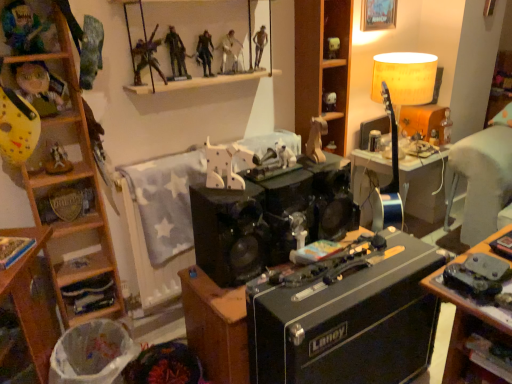
Measure the distance between metallic figure at upper center, which is the 3th person from left to right, and camera.

The depth of metallic figure at upper center, which is the 3th person from left to right, is 1.57 meters.

Describe the element at coordinates (205, 53) in the screenshot. I see `metallic figure at upper center, which is the 3th person in right-to-left order` at that location.

Find the location of a particular element. The image size is (512, 384). smooth white figure at upper center, which is the 2th person from right to left is located at coordinates (230, 53).

The width and height of the screenshot is (512, 384). Describe the element at coordinates (322, 66) in the screenshot. I see `wooden shelf at center, the 3th shelf from the left` at that location.

Locate an element on the screen. The image size is (512, 384). wooden shelf at center, the 2th shelf ordered from the bottom is located at coordinates (322, 66).

Measure the distance between point (x=103, y=325) and camera.

1.52 meters.

You are a GUI agent. You are given a task and a screenshot of the screen. Output one action in this format:
    pyautogui.click(x=<x>, y=<y>)
    Task: Click on the metallic silver figure at upper center, the 7th person positioned from the left
    The height and width of the screenshot is (384, 512).
    Given the screenshot: What is the action you would take?
    point(260,45)

This screenshot has height=384, width=512. Find the location of `metallic figure at upper center, which is the fourth person from left to right`. metallic figure at upper center, which is the fourth person from left to right is located at coordinates 176,54.

Which is less distant, (233, 54) or (326, 96)?

Positioned in front is point (233, 54).

Which is behind, smooth white figure at upper center, which is the 2th person from right to left, or matte white skull at upper center, which appears as the second toy when viewed from the top?

matte white skull at upper center, which appears as the second toy when viewed from the top.

From a real-world perspective, is smooth white figure at upper center, which is the 2th person from right to left, physically located above or below matte white skull at upper center, which is the 1th toy from right to left?

Clearly, from a real-world perspective, smooth white figure at upper center, which is the 2th person from right to left, is above matte white skull at upper center, which is the 1th toy from right to left.

Are smooth white figure at upper center, which is the 6th person in left-to-right order, and matte white skull at upper center, the 1th toy when ordered from back to front, beside each other?

No, smooth white figure at upper center, which is the 6th person in left-to-right order, is not next to matte white skull at upper center, the 1th toy when ordered from back to front.

Does metallic silver figurine at left, the first toy when ordered from left to right, have a lesser width compared to wooden cabinet at left?

Yes, metallic silver figurine at left, the first toy when ordered from left to right, is thinner than wooden cabinet at left.

From a real-world perspective, which is physically below, metallic silver figurine at left, which is the 2th toy in bottom-to-top order, or wooden cabinet at left?

From a 3D spatial view, wooden cabinet at left is below.

Measure the distance between metallic silver figurine at left, the first toy when ordered from left to right, and wooden cabinet at left.

They are 10.09 inches apart.

Is point (56, 154) closer or farther from the camera than point (53, 281)?

Point (56, 154) appears to be closer to the viewer than point (53, 281).

Looking at their sizes, would you say wooden shelves at lower left, positioned as the third shelf in right-to-left order, is wider or thinner than metallic figure at upper center, the 5th person when ordered from right to left?

Considering their sizes, wooden shelves at lower left, positioned as the third shelf in right-to-left order, looks broader than metallic figure at upper center, the 5th person when ordered from right to left.

Is wooden shelves at lower left, which appears as the 1th shelf when ordered from the bottom, positioned behind metallic figure at upper center, which is the 3th person from left to right?

Yes, it is.

From a real-world perspective, starting from the wooden shelves at lower left, which appears as the 1th shelf when ordered from the bottom, which person is the 2nd one vertically above it? Please provide its 2D coordinates.

[(147, 57)]

Is metallic figure at upper center, which is the 3th person from left to right, closer to the viewer compared to matte yellow mask at left, positioned as the first person in left-to-right order?

No.

Does point (158, 64) lie in front of point (32, 68)?

No.

Can you confirm if metallic figure at upper center, which is the 3th person from left to right, is smaller than matte yellow mask at left, positioned as the first person in left-to-right order?

Indeed, metallic figure at upper center, which is the 3th person from left to right, has a smaller size compared to matte yellow mask at left, positioned as the first person in left-to-right order.

Looking at this image, from the image's perspective, between metallic figure at upper center, which is the 3th person from left to right, and matte yellow mask at left, positioned as the first person in left-to-right order, which one is located above?

metallic figure at upper center, which is the 3th person from left to right, appears higher in the image.

Considering the points (257, 40) and (123, 360), which point is in front, point (257, 40) or point (123, 360)?

The point (123, 360) is in front.

Is metallic silver figure at upper center, the 1th person from the right, inside the boundaries of white plastic trash bin at lower left, or outside?

metallic silver figure at upper center, the 1th person from the right, is outside white plastic trash bin at lower left.

From the image's perspective, is metallic silver figure at upper center, the 7th person positioned from the left, located beneath white plastic trash bin at lower left?

Incorrect, from the image's perspective, metallic silver figure at upper center, the 7th person positioned from the left, is higher than white plastic trash bin at lower left.

Considering the positions of objects white matte dog at center, the third toy ordered from the bottom, and matte yellow mask at left, placed as the seventh person when sorted from right to left, in the image provided, who is more to the right, white matte dog at center, the third toy ordered from the bottom, or matte yellow mask at left, placed as the seventh person when sorted from right to left,?

white matte dog at center, the third toy ordered from the bottom, is more to the right.

From a real-world perspective, is white matte dog at center, marked as the third toy in a left-to-right arrangement, above or below matte yellow mask at left, positioned as the first person in left-to-right order?

white matte dog at center, marked as the third toy in a left-to-right arrangement, is below matte yellow mask at left, positioned as the first person in left-to-right order.

From a real-world perspective, which person is the 1st one above the white matte dog at center, which is the 3th toy from front to back? Please provide its 2D coordinates.

[(40, 87)]

How many degrees apart are the facing directions of white matte dog at center, which ranks as the 3th toy in top-to-bottom order, and matte yellow mask at left, positioned as the first person in left-to-right order?

white matte dog at center, which ranks as the 3th toy in top-to-bottom order, and matte yellow mask at left, positioned as the first person in left-to-right order, are facing 1.68 degrees away from each other.

Considering the relative sizes of metallic silver figure at upper center, the 7th person positioned from the left, and wooden shelves at lower left, which is the first shelf from left to right, in the image provided, is metallic silver figure at upper center, the 7th person positioned from the left, shorter than wooden shelves at lower left, which is the first shelf from left to right,?

Incorrect, the height of metallic silver figure at upper center, the 7th person positioned from the left, does not fall short of that of wooden shelves at lower left, which is the first shelf from left to right.

Between metallic silver figure at upper center, the 7th person positioned from the left, and wooden shelves at lower left, which appears as the 1th shelf when ordered from the bottom, which one has smaller width?

Thinner between the two is metallic silver figure at upper center, the 7th person positioned from the left.

Is metallic silver figure at upper center, the 1th person from the right, far from wooden shelves at lower left, which appears as the 1th shelf when ordered from the bottom?

That's right, there is a large distance between metallic silver figure at upper center, the 1th person from the right, and wooden shelves at lower left, which appears as the 1th shelf when ordered from the bottom.

From a real-world perspective, is metallic silver figure at upper center, the 7th person positioned from the left, positioned under wooden shelves at lower left, the third shelf viewed from the top, based on gravity?

No, from a real-world perspective, metallic silver figure at upper center, the 7th person positioned from the left, is not beneath wooden shelves at lower left, the third shelf viewed from the top.

The image size is (512, 384). Identify the location of the 4th toy to the right of the smooth white figure at upper center, which is the 6th person in left-to-right order, counting from the anchor's position. (329, 101).

From the wooden cabinet at left, count 2nd toys backward and point to it. Please provide its 2D coordinates.

[(57, 161)]

Looking at the image, which one is located further to matte yellow mask at left, positioned as the first person in left-to-right order, wooden horse at center, the 5th toy from the back, or wooden picture frame at upper right?

wooden picture frame at upper right is positioned further to the anchor matte yellow mask at left, positioned as the first person in left-to-right order.

Based on their spatial positions, is smooth white figure at upper center, which is the 6th person in left-to-right order, or matte yellow lampshade at upper right closer to matte white skull at upper center, acting as the 5th toy starting from the left?

matte yellow lampshade at upper right is closer to matte white skull at upper center, acting as the 5th toy starting from the left.

From the image, which object appears to be farther from wooden horse at center, which appears as the fourth toy when viewed from the right, wooden cabinet at left or white plastic trash bin at lower left?

white plastic trash bin at lower left lies further to wooden horse at center, which appears as the fourth toy when viewed from the right, than the other object.

Based on their spatial positions, is metallic figurines at upper center, placed as the first shelf when sorted from top to bottom, or wooden horse at center, the 2th toy in the left-to-right sequence, closer to metallic silver figurine at left, which ranks as the fifth toy in right-to-left order?

wooden horse at center, the 2th toy in the left-to-right sequence, is positioned closer to the anchor metallic silver figurine at left, which ranks as the fifth toy in right-to-left order.

Looking at this image, looking at the image, which one is located further to metallic silver figurine at left, which ranks as the fifth toy in right-to-left order, blue fabric doll at upper left, which ranks as the 6th person in right-to-left order, or matte yellow lampshade at upper right?

matte yellow lampshade at upper right is positioned further to the anchor metallic silver figurine at left, which ranks as the fifth toy in right-to-left order.

Estimate the real-world distances between objects in this image. Which object is closer to wooden shelves at lower left, which appears as the 1th shelf when ordered from the bottom, matte white skull at upper center, which is the 1th toy from right to left, or wooden shelf at center, marked as the first shelf in a right-to-left arrangement?

Among the two, wooden shelf at center, marked as the first shelf in a right-to-left arrangement, is located nearer to wooden shelves at lower left, which appears as the 1th shelf when ordered from the bottom.

Based on their spatial positions, is wooden picture frame at upper right or white matte dog at center, which ranks as the third toy in right-to-left order, closer to metallic figure at upper center, which is the 3th person in right-to-left order?

white matte dog at center, which ranks as the third toy in right-to-left order, is positioned closer to the anchor metallic figure at upper center, which is the 3th person in right-to-left order.

Based on their spatial positions, is wooden shelves at lower left, the third shelf viewed from the top, or wooden horse at center, the 2th toy in the left-to-right sequence, closer to matte yellow mask at left, positioned as the first person in left-to-right order?

wooden horse at center, the 2th toy in the left-to-right sequence.

Where is `shelf between metallic figure at upper center, which is the 3th person from left to right, and metallic silver figure at upper center, the 7th person positioned from the left, in the horizontal direction`? The height and width of the screenshot is (384, 512). shelf between metallic figure at upper center, which is the 3th person from left to right, and metallic silver figure at upper center, the 7th person positioned from the left, in the horizontal direction is located at coordinates tap(211, 78).

Where is `person between smooth white figure at upper center, which is the 6th person in left-to-right order, and wooden picture frame at upper right`? Image resolution: width=512 pixels, height=384 pixels. person between smooth white figure at upper center, which is the 6th person in left-to-right order, and wooden picture frame at upper right is located at coordinates (260, 45).

You are a GUI agent. You are given a task and a screenshot of the screen. Output one action in this format:
    pyautogui.click(x=<x>, y=<y>)
    Task: Click on the picture frame between wooden cabinet at left and matte yellow lampshade at upper right in the horizontal direction
    
    Given the screenshot: What is the action you would take?
    pyautogui.click(x=378, y=14)

Identify the location of person between smooth white figure at upper center, which is the 2th person from right to left, and matte plastic action figure at upper center, which is the first toy from top to bottom, in the horizontal direction. The height and width of the screenshot is (384, 512). click(x=260, y=45).